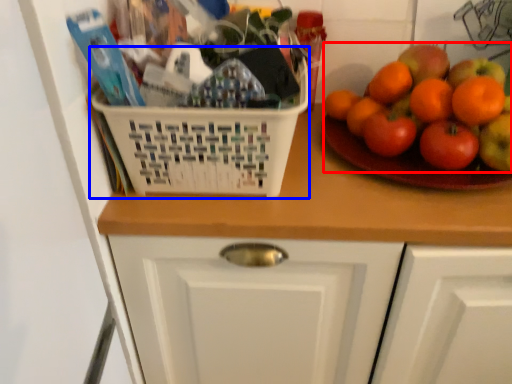
Question: Which point is further to the camera, fruit (highlighted by a red box) or basket (highlighted by a blue box)?

Choices:
 (A) fruit
 (B) basket

Answer: (A)